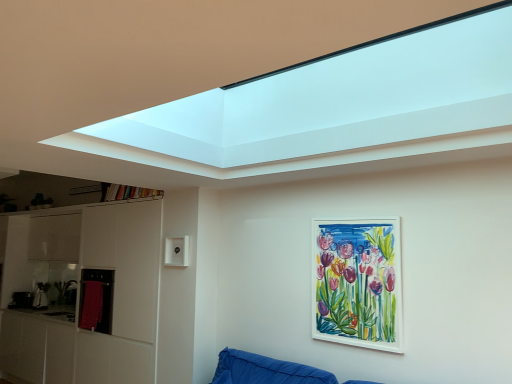
Question: Considering the positions of white matte picture frame at center-right and red towel at left in the image, is white matte picture frame at center-right bigger or smaller than red towel at left?

Choices:
 (A) small
 (B) big

Answer: (A)

Question: From a real-world perspective, is white matte picture frame at center-right positioned above or below red towel at left?

Choices:
 (A) above
 (B) below

Answer: (A)

Question: In the image, is white matte picture frame at center-right positioned in front of or behind red towel at left?

Choices:
 (A) front
 (B) behind

Answer: (A)

Question: Would you say red towel at left is inside or outside white matte picture frame at center-right?

Choices:
 (A) outside
 (B) inside

Answer: (A)

Question: Considering the positions of red towel at left and white matte picture frame at center-right in the image, is red towel at left wider or thinner than white matte picture frame at center-right?

Choices:
 (A) wide
 (B) thin

Answer: (A)

Question: From a real-world perspective, is red towel at left physically located above or below white matte picture frame at center-right?

Choices:
 (A) above
 (B) below

Answer: (B)

Question: Would you say red towel at left is to the left or to the right of white matte picture frame at center-right in the picture?

Choices:
 (A) right
 (B) left

Answer: (B)